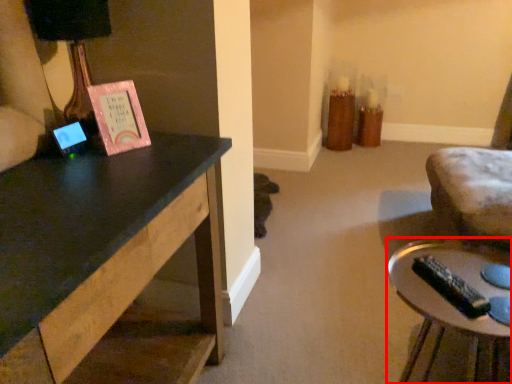
Question: From the image's perspective, what is the correct spatial relationship of table (annotated by the red box) in relation to table lamp?

Choices:
 (A) below
 (B) above

Answer: (A)